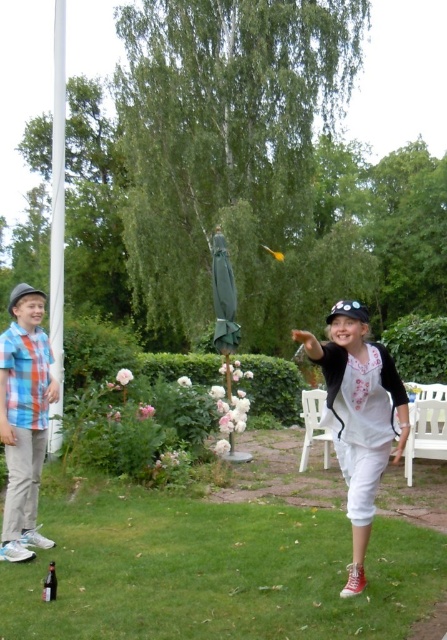
Does white plastic chair at lower right have a lesser width compared to translucent glass bottle at lower left?

No, white plastic chair at lower right is not thinner than translucent glass bottle at lower left.

Can you confirm if white plastic chair at lower right is positioned to the left of translucent glass bottle at lower left?

Incorrect, white plastic chair at lower right is not on the left side of translucent glass bottle at lower left.

The image size is (447, 640). Identify the location of white plastic chair at lower right. (425, 433).

At what (x,y) coordinates should I click in order to perform the action: click on white plastic chair at lower right. Please return your answer as a coordinate pair (x, y). Image resolution: width=447 pixels, height=640 pixels. Looking at the image, I should click on (425, 433).

Is white plastic chair at lower right taller than white plastic chair at lower center?

No, white plastic chair at lower right is not taller than white plastic chair at lower center.

Can you confirm if white plastic chair at lower right is shorter than white plastic chair at lower center?

Correct, white plastic chair at lower right is not as tall as white plastic chair at lower center.

The width and height of the screenshot is (447, 640). In order to click on white plastic chair at lower right in this screenshot , I will do `click(425, 433)`.

Who is positioned more to the left, white cotton shirt at center or translucent glass bottle at lower left?

From the viewer's perspective, translucent glass bottle at lower left appears more on the left side.

Can you confirm if white cotton shirt at center is positioned above translucent glass bottle at lower left?

Yes.

Is point (348, 308) closer to camera compared to point (50, 600)?

No, (348, 308) is behind (50, 600).

At what (x,y) coordinates should I click in order to perform the action: click on white cotton shirt at center. Please return your answer as a coordinate pair (x, y). Image resolution: width=447 pixels, height=640 pixels. Looking at the image, I should click on (358, 416).